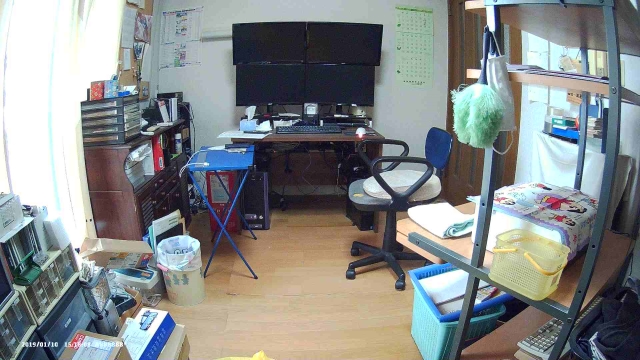
You are a GUI agent. You are given a task and a screenshot of the screen. Output one action in this format:
    pyautogui.click(x=<x>, y=<y>)
    Task: Click on the tray
    
    Given the screenshot: What is the action you would take?
    (x=227, y=165)